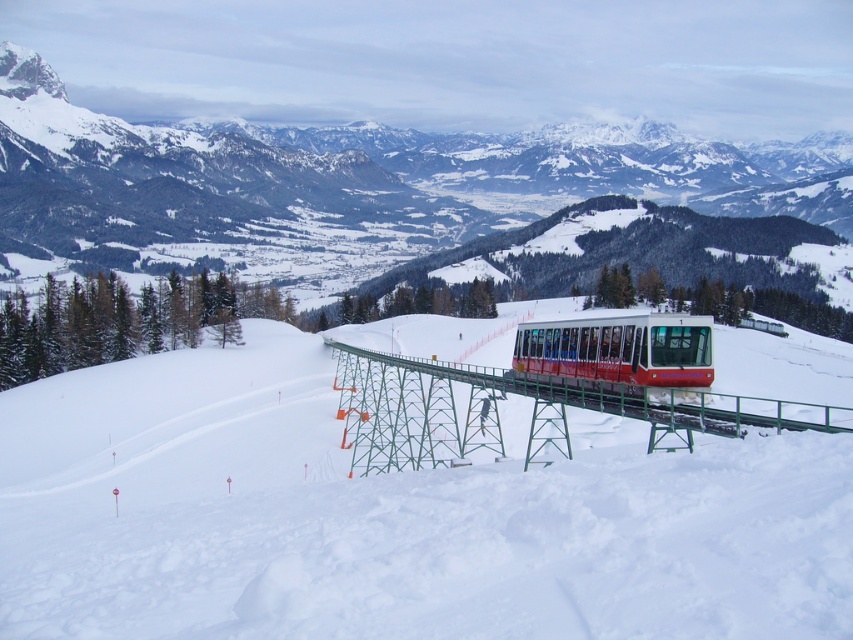
Question: Which point is farther from the camera taking this photo?

Choices:
 (A) (646, 384)
 (B) (387, 396)
 (C) (671, 170)
 (D) (717, 472)

Answer: (C)

Question: Which object is the farthest from the white snow-covered mountain at center?

Choices:
 (A) red matte train at center
 (B) metallic red bridge at center
 (C) white snow ski slope at center

Answer: (A)

Question: Does white snow-covered mountain at center have a greater width compared to red matte train at center?

Choices:
 (A) yes
 (B) no

Answer: (A)

Question: Estimate the real-world distances between objects in this image. Which object is closer to the white snow-covered mountain at center?

Choices:
 (A) red matte train at center
 (B) metallic red bridge at center
 (C) white snow ski slope at center

Answer: (C)

Question: Does white snow ski slope at center have a greater width compared to white snow-covered mountain at center?

Choices:
 (A) no
 (B) yes

Answer: (A)

Question: Observing the image, what is the correct spatial positioning of white snow-covered mountain at center in reference to red matte train at center?

Choices:
 (A) left
 (B) right

Answer: (B)